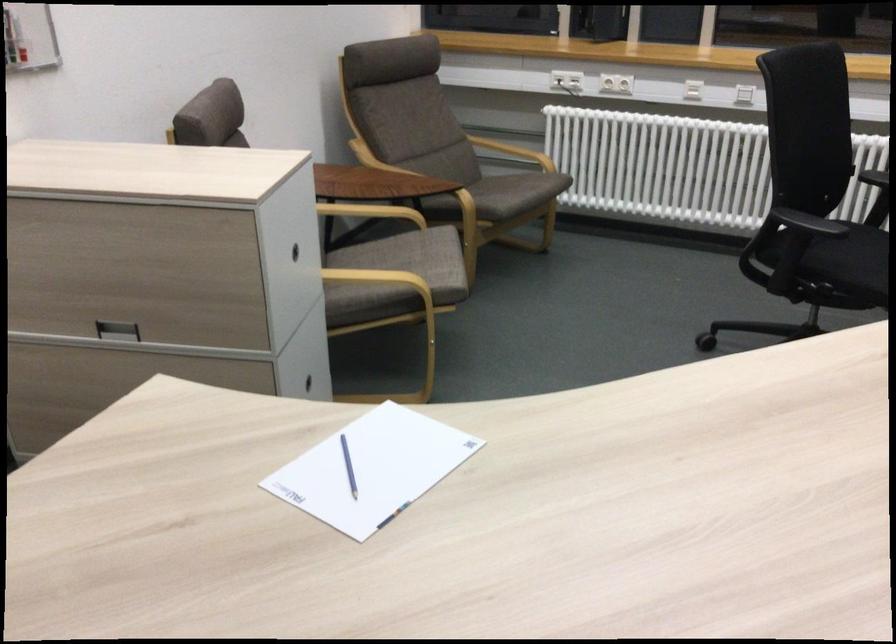
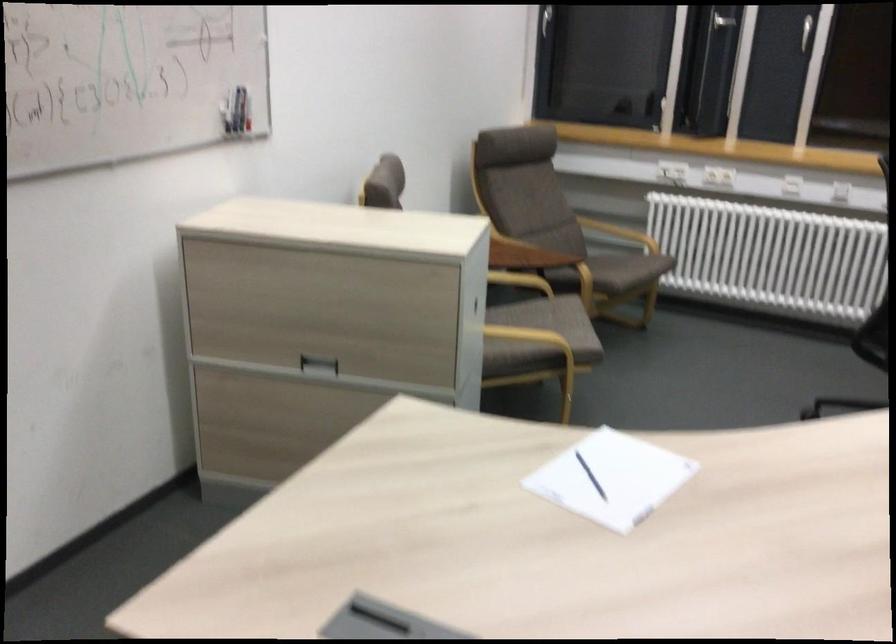
Where in the second image is the point corresponding to [364,462] from the first image?

(590, 476)